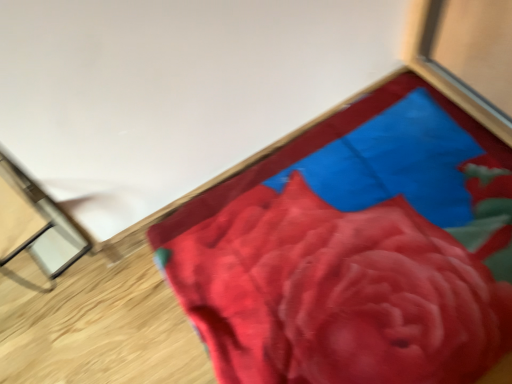
Identify the location of free point above velvety red rose at center (from a real-world perspective). Image resolution: width=512 pixels, height=384 pixels. (353, 244).